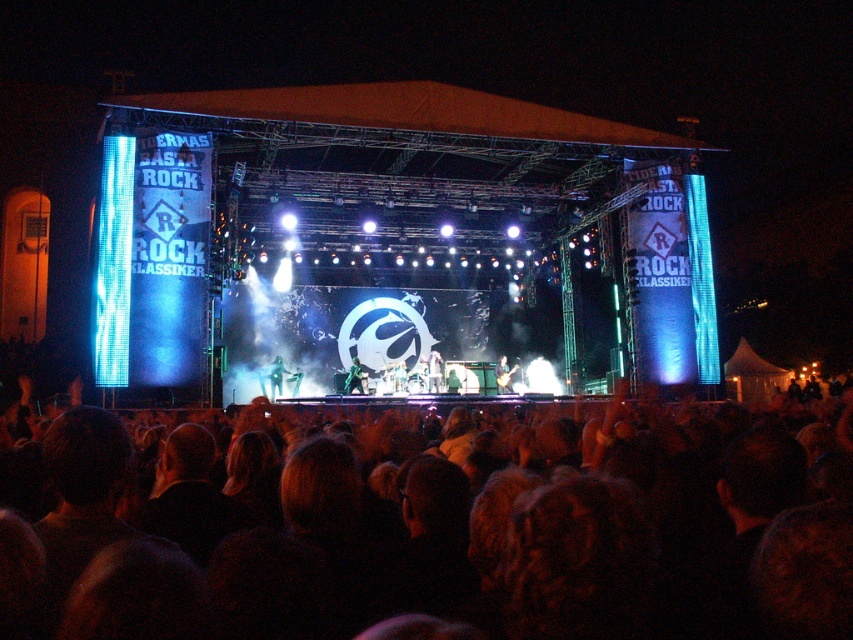
Question: Which of these objects is positioned closest to the green metallic guitar at stage center?

Choices:
 (A) shiny black guitar at center
 (B) green fabric figure at center stage

Answer: (B)

Question: Observing the image, what is the correct spatial positioning of black fabric crowd at lower center in reference to green metallic guitar at stage center?

Choices:
 (A) right
 (B) left

Answer: (A)

Question: Which of the following is the closest to the observer?

Choices:
 (A) (357, 611)
 (B) (434, 378)
 (C) (497, 385)

Answer: (A)

Question: Considering the real-world distances, which object is farthest from the metallic guitar at center?

Choices:
 (A) shiny black guitar at center
 (B) green metallic guitar at stage center
 (C) black fabric crowd at lower center

Answer: (C)

Question: Is black fabric crowd at lower center thinner than green fabric figure at center stage?

Choices:
 (A) no
 (B) yes

Answer: (A)

Question: Can you confirm if black fabric crowd at lower center is positioned to the left of metallic guitar at center?

Choices:
 (A) no
 (B) yes

Answer: (A)